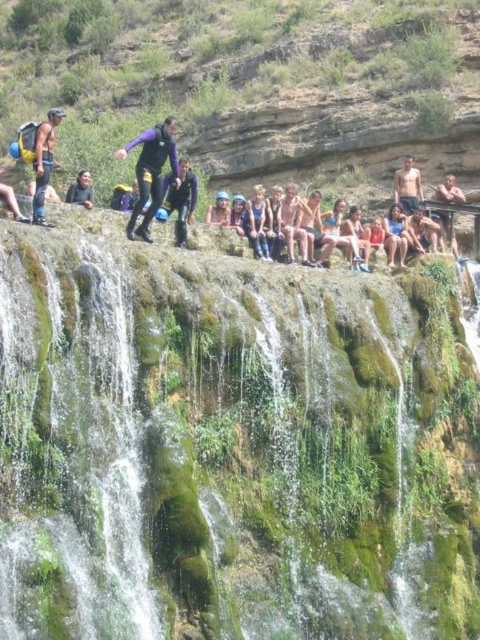
Question: Can you confirm if purple matte wetsuit at center is positioned to the right of skinny man at upper right?

Choices:
 (A) no
 (B) yes

Answer: (A)

Question: From the image, what is the correct spatial relationship of green mossy rock at center in relation to matte black wetsuit at left?

Choices:
 (A) above
 (B) below

Answer: (B)

Question: Which of the following is the farthest from the observer?

Choices:
 (A) matte black wetsuit at center
 (B) skinny man at upper right
 (C) purple matte wetsuit at center
 (D) green mossy rock at center

Answer: (B)

Question: Estimate the real-world distances between objects in this image. Which object is closer to the matte black wetsuit at center?

Choices:
 (A) skinny man at upper right
 (B) matte black wetsuit at left
 (C) green mossy rock at center
 (D) purple matte wetsuit at center

Answer: (D)

Question: Is green mossy rock at center wider than matte black wetsuit at left?

Choices:
 (A) no
 (B) yes

Answer: (B)

Question: Which of these objects is positioned closest to the skinny man at upper right?

Choices:
 (A) purple matte wetsuit at center
 (B) matte black wetsuit at left
 (C) green mossy rock at center

Answer: (A)